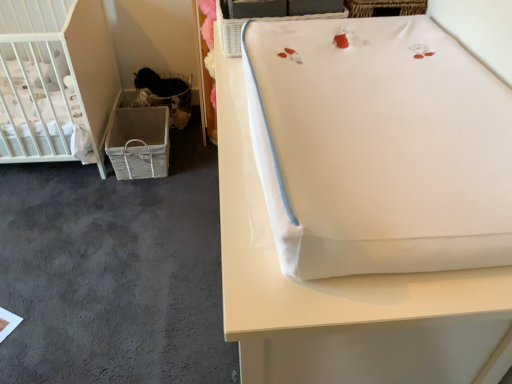
Locate an element on the screen. The height and width of the screenshot is (384, 512). free space in front of white matte crib at left is located at coordinates (55, 219).